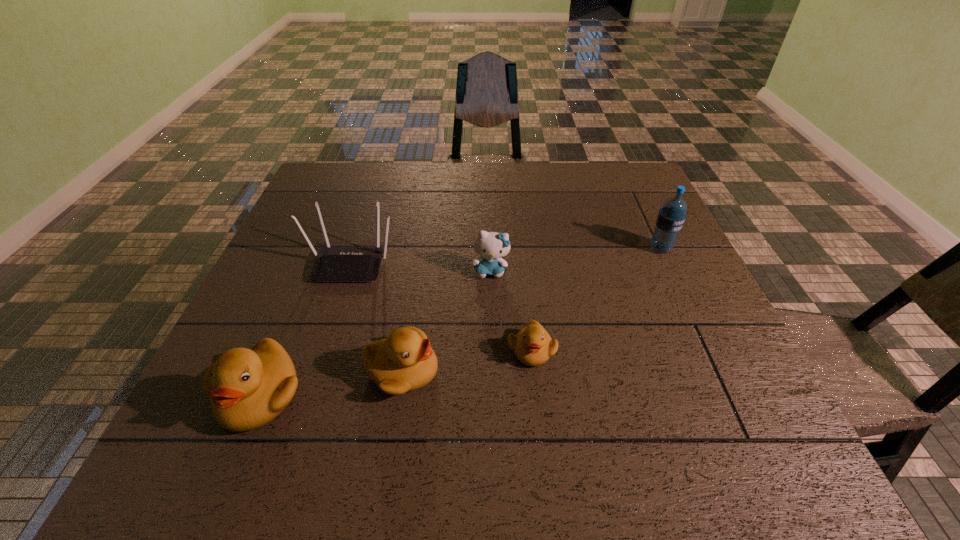
All ducklings are currently evenly spaced. To continue this pattern, where would you add another duckling on the right? Please point out a vacant spot. Please provide its 2D coordinates. Your answer should be formatted as a tuple, i.e. [(x, y)], where the tuple contains the x and y coordinates of a point satisfying the conditions above.

[(651, 330)]